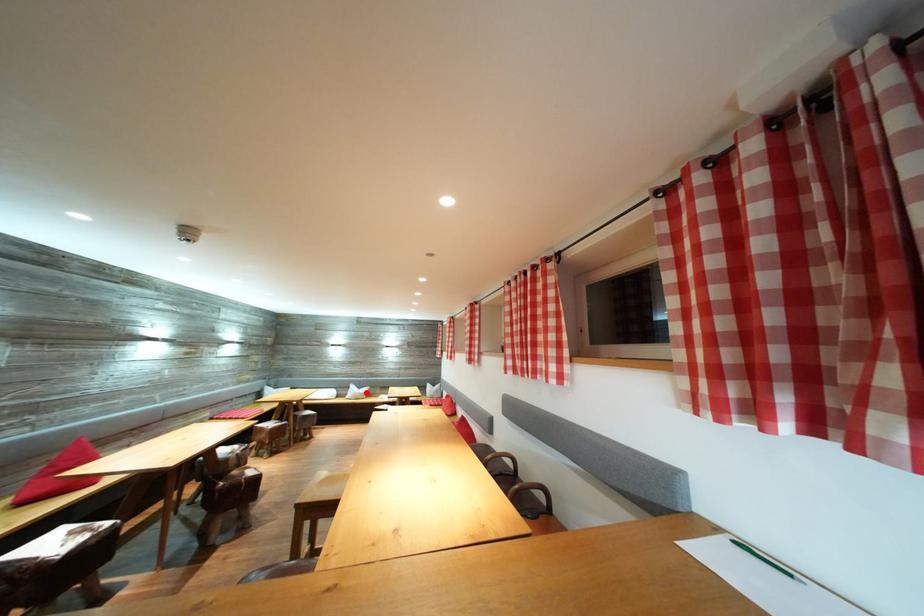
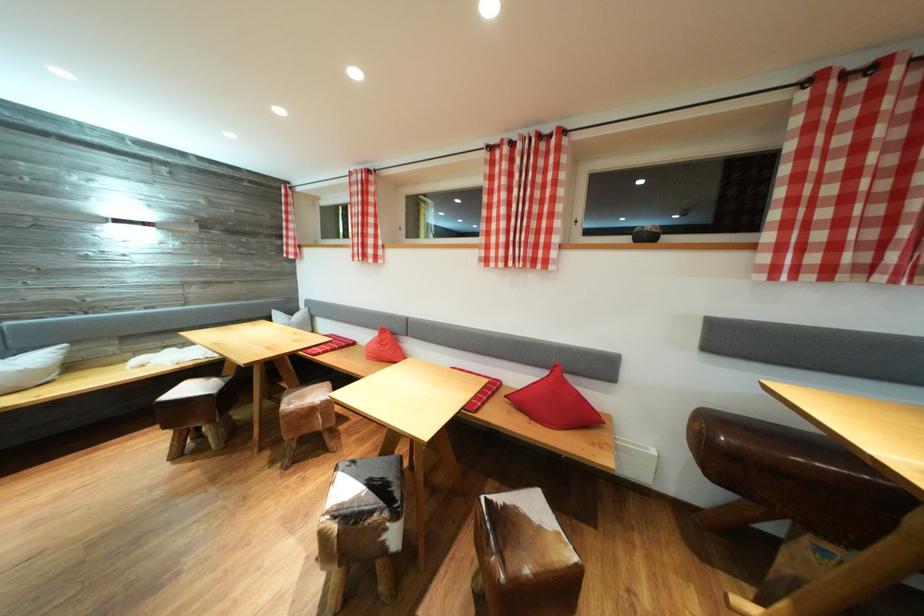
Question: I am providing you with two images of the same scene from different viewpoints. A red point is shown in image1. For the corresponding object point in image2, is it positioned nearer or farther from the camera?

Choices:
 (A) Nearer
 (B) Farther

Answer: (A)